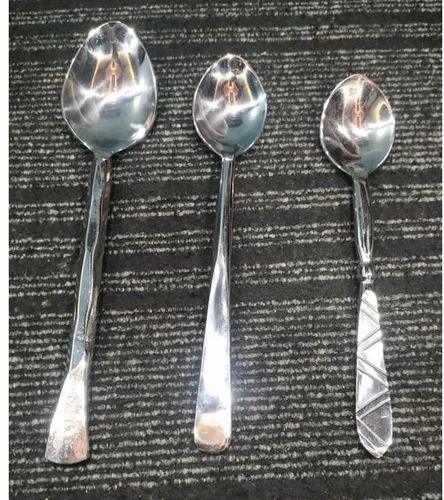
Locate an element on the screen. This screenshot has height=500, width=444. spoon is located at coordinates (357, 176).